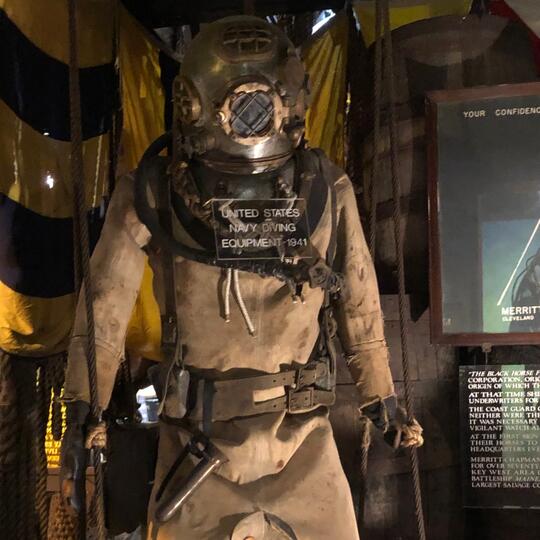
What are the coordinates of `screen` in the screenshot? It's located at (254, 111).